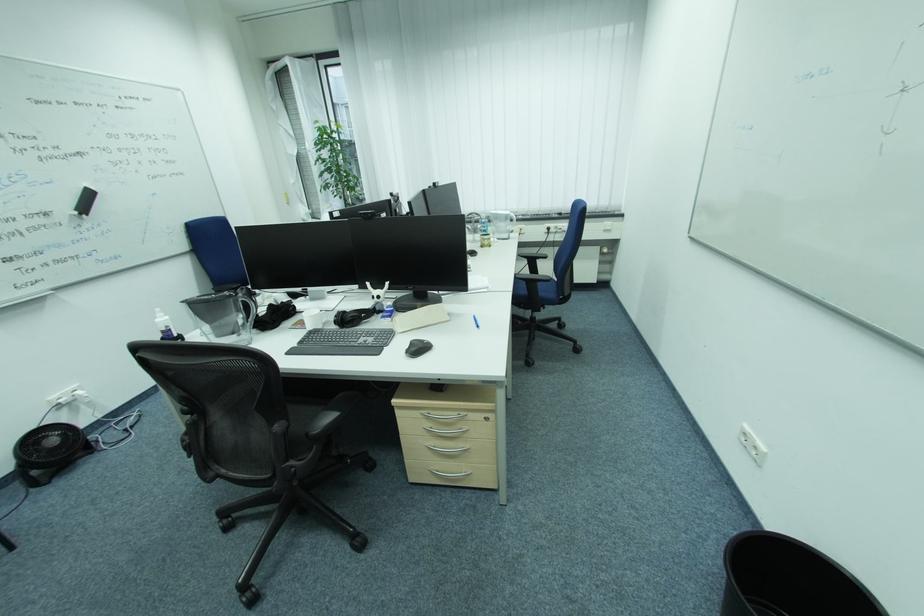
Where would you lift the white spray bottle? Please return your answer as a coordinate pair (x, y).

(164, 325)